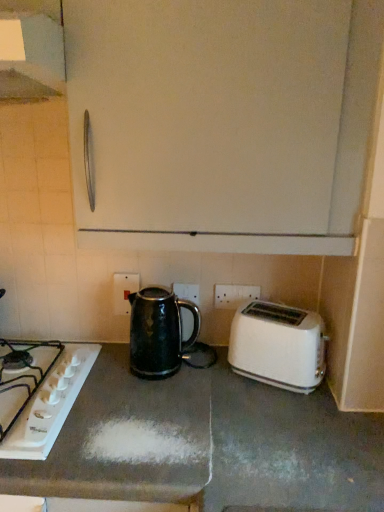
Question: Is black glossy kettle at center in contact with white glossy gas stove at lower left?

Choices:
 (A) yes
 (B) no

Answer: (B)

Question: Is black glossy kettle at center bigger than white glossy gas stove at lower left?

Choices:
 (A) yes
 (B) no

Answer: (A)

Question: From the image's perspective, is black glossy kettle at center on white glossy gas stove at lower left?

Choices:
 (A) yes
 (B) no

Answer: (A)

Question: Can you confirm if black glossy kettle at center is thinner than white glossy gas stove at lower left?

Choices:
 (A) no
 (B) yes

Answer: (B)

Question: Does black glossy kettle at center come behind white glossy gas stove at lower left?

Choices:
 (A) no
 (B) yes

Answer: (B)

Question: Considering the relative sizes of black glossy kettle at center and white glossy gas stove at lower left in the image provided, is black glossy kettle at center smaller than white glossy gas stove at lower left?

Choices:
 (A) no
 (B) yes

Answer: (A)

Question: Can you see white glossy gas stove at lower left touching black glossy kettle at center?

Choices:
 (A) yes
 (B) no

Answer: (B)

Question: Could you tell me if white glossy gas stove at lower left is facing black glossy kettle at center?

Choices:
 (A) yes
 (B) no

Answer: (B)

Question: Can you confirm if white glossy gas stove at lower left is bigger than black glossy kettle at center?

Choices:
 (A) no
 (B) yes

Answer: (A)

Question: From a real-world perspective, is white glossy gas stove at lower left located higher than black glossy kettle at center?

Choices:
 (A) yes
 (B) no

Answer: (B)

Question: From the image's perspective, is white glossy gas stove at lower left located beneath black glossy kettle at center?

Choices:
 (A) yes
 (B) no

Answer: (A)

Question: Is white glossy gas stove at lower left positioned with its back to black glossy kettle at center?

Choices:
 (A) yes
 (B) no

Answer: (B)

Question: Is white plastic toaster at lower right directly adjacent to white plastic electric outlet at center, the first electric outlet from the left?

Choices:
 (A) no
 (B) yes

Answer: (A)